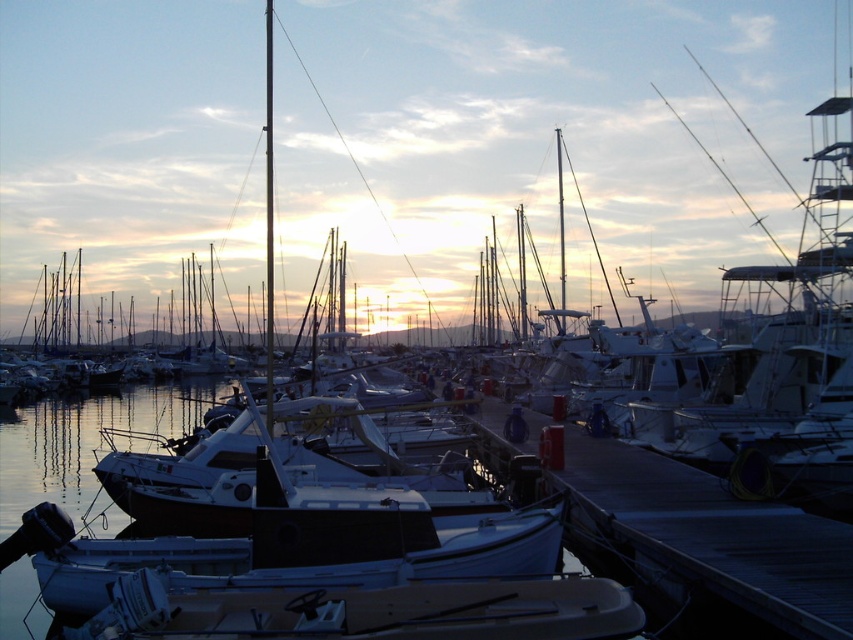
Question: Which object is farther from the camera taking this photo?

Choices:
 (A) white matte boat at lower center
 (B) smooth wood dock at center
 (C) white matte boat at center

Answer: (C)

Question: Among these points, which one is nearest to the camera?

Choices:
 (A) (651, 547)
 (B) (635, 609)

Answer: (B)

Question: Among these objects, which one is farthest from the camera?

Choices:
 (A) smooth wood dock at center
 (B) white matte boat at lower center

Answer: (B)

Question: Is smooth wood dock at center to the left of white matte boat at lower center from the viewer's perspective?

Choices:
 (A) yes
 (B) no

Answer: (B)

Question: Does smooth wood dock at center have a lesser width compared to white matte boat at lower center?

Choices:
 (A) yes
 (B) no

Answer: (A)

Question: Does white matte boat at lower center lie behind white matte boat at center?

Choices:
 (A) yes
 (B) no

Answer: (B)